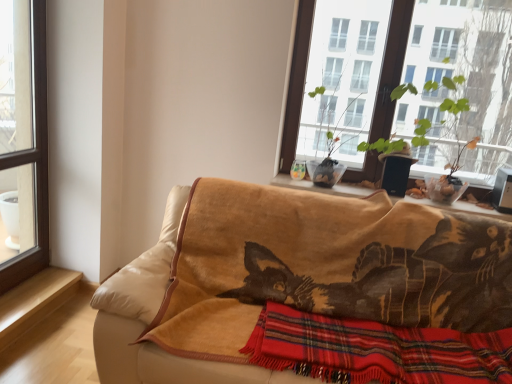
At what (x,y) coordinates should I click in order to perform the action: click on vacant space to the right of transparent glass window at left, which is counted as the 2th window, starting from the right. Please return your answer as a coordinate pair (x, y). This screenshot has height=384, width=512. Looking at the image, I should click on (48, 284).